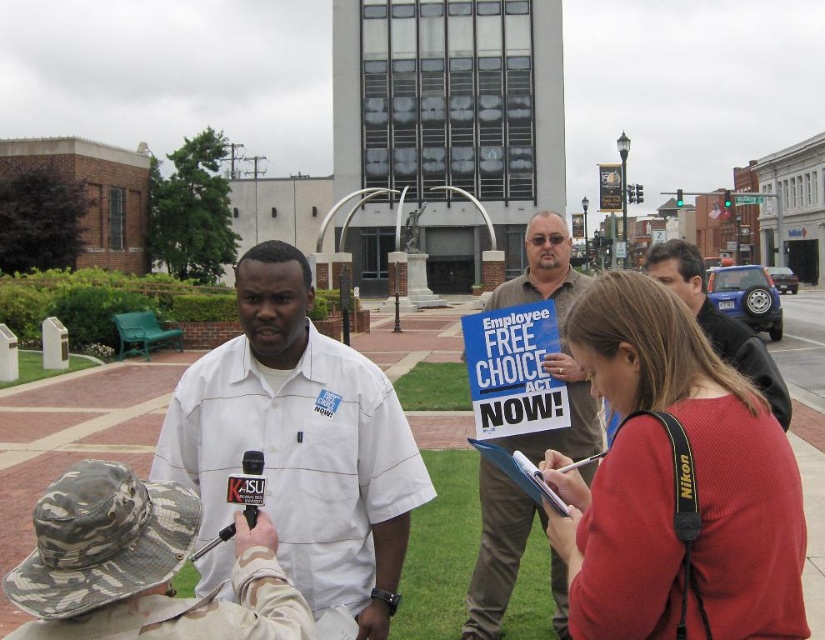
Question: In this image, where is red knit sweater at center located relative to dark brown leather jacket at center?

Choices:
 (A) below
 (B) above

Answer: (A)

Question: Is brown paper bag at center above dark brown leather jacket at center?

Choices:
 (A) no
 (B) yes

Answer: (A)

Question: Which object is the closest to the brown paper bag at center?

Choices:
 (A) white cotton shirt at center
 (B) red knit sweater at center

Answer: (A)

Question: Which of the following is the farthest from the observer?

Choices:
 (A) brown paper bag at center
 (B) white cotton shirt at center
 (C) red knit sweater at center

Answer: (A)

Question: Is white cotton shirt at center closer to the viewer compared to brown paper bag at center?

Choices:
 (A) yes
 (B) no

Answer: (A)

Question: Which object is positioned farthest from the dark brown leather jacket at center?

Choices:
 (A) white cotton shirt at center
 (B) brown paper bag at center
 (C) red knit sweater at center

Answer: (A)